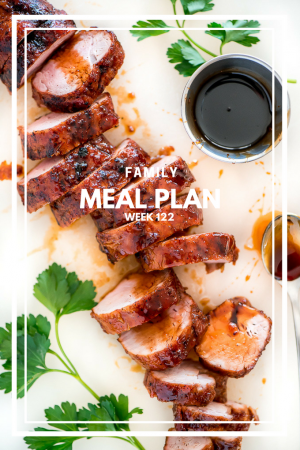
Find the location of a particular element. The height and width of the screenshot is (450, 300). metal pot is located at coordinates (191, 91).